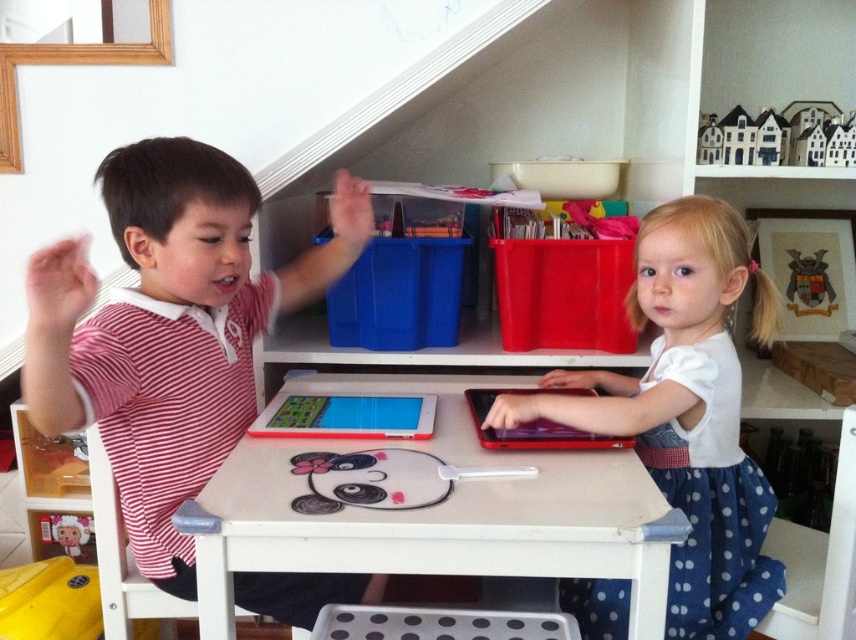
You are a photographer standing in front of the table. You want to take a photo of both the striped cotton shirt at left and the metallic shield at upper right. Which object should you focus on first to ensure both are in focus?

You should focus on the striped cotton shirt at left first because it is closer to the viewer than the metallic shield at upper right, so adjusting focus from near to far will help both objects be in focus.